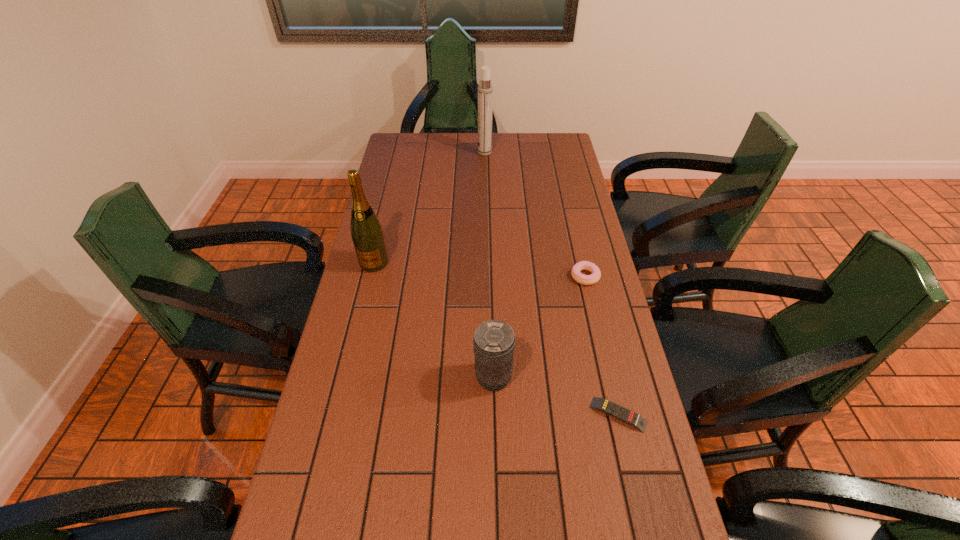
This screenshot has height=540, width=960. In the image, there is a desktop. What are the coordinates of `vacant space at the right edge` in the screenshot? It's located at (653, 477).

Where is `vacant space at the far right corner of the desktop`? The width and height of the screenshot is (960, 540). vacant space at the far right corner of the desktop is located at coordinates (555, 159).

This screenshot has height=540, width=960. In order to click on free space between the wine bottle and the second shortest object in this screenshot , I will do `click(480, 269)`.

This screenshot has width=960, height=540. Find the location of `free space between the third tallest object and the farthest object`. free space between the third tallest object and the farthest object is located at coordinates (489, 265).

Locate an element on the screen. The width and height of the screenshot is (960, 540). vacant space that is in between the doughnut and the wine bottle is located at coordinates (480, 269).

At what (x,y) coordinates should I click in order to perform the action: click on blank region between the nearest object and the farthest object. Please return your answer as a coordinate pair (x, y). Looking at the image, I should click on (551, 284).

I want to click on free point between the aerosol can and the nearest object, so click(551, 284).

Find the location of a particular element. vacant point located between the second shortest object and the wine bottle is located at coordinates (480, 269).

Where is `unoccupied position between the wine bottle and the telephoto lens`? This screenshot has height=540, width=960. unoccupied position between the wine bottle and the telephoto lens is located at coordinates (433, 320).

You are a GUI agent. You are given a task and a screenshot of the screen. Output one action in this format:
    pyautogui.click(x=<x>, y=<y>)
    Task: Click on the vacant area that lies between the aerosol can and the third shortest object
    
    Given the screenshot: What is the action you would take?
    pyautogui.click(x=489, y=265)